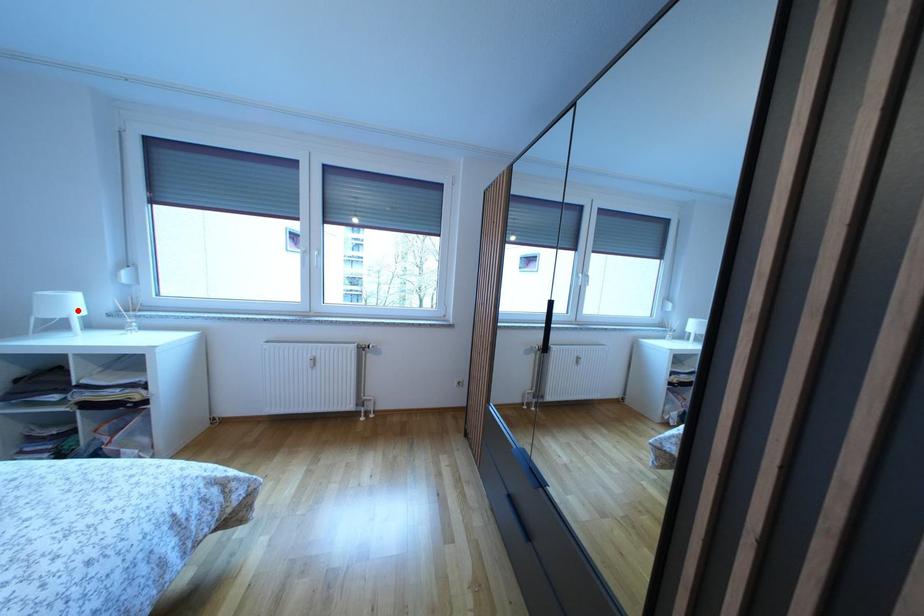
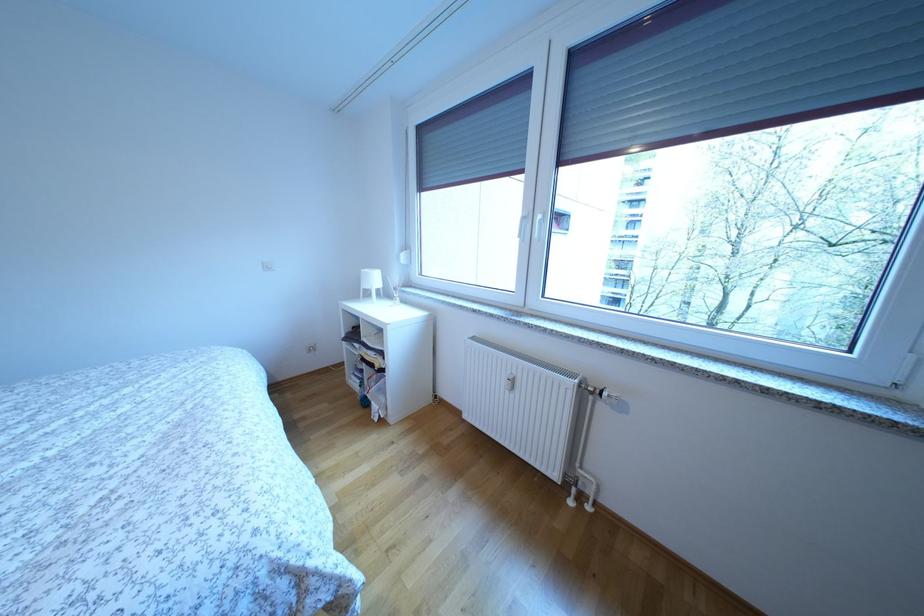
The point at the highlighted location is marked in the first image. Where is the corresponding point in the second image?

(382, 285)